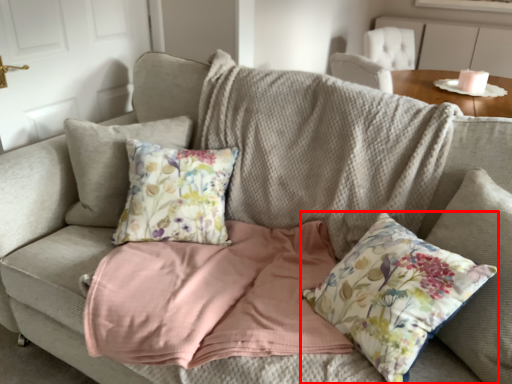
Question: From the image's perspective, what is the correct spatial relationship of pillow (annotated by the red box) in relation to table?

Choices:
 (A) below
 (B) above

Answer: (A)